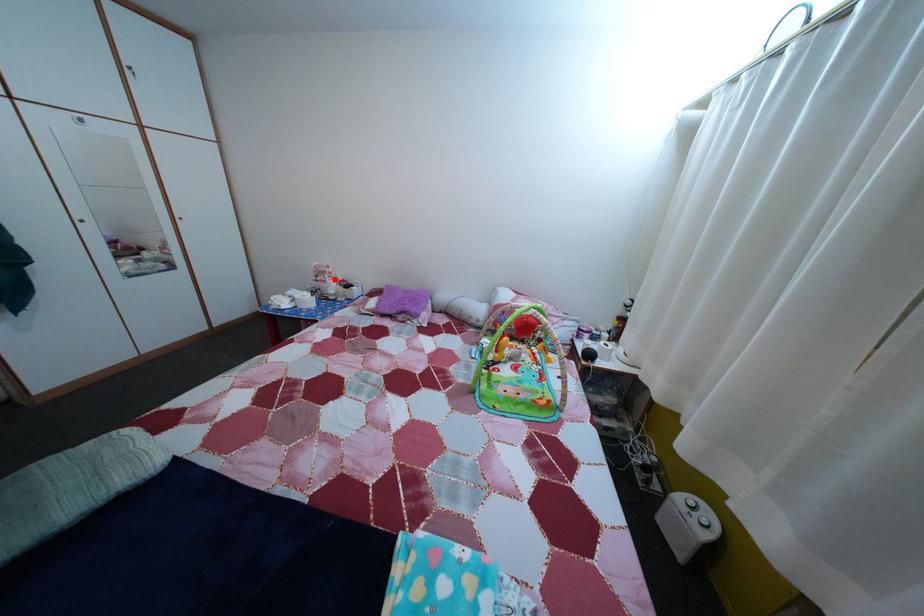
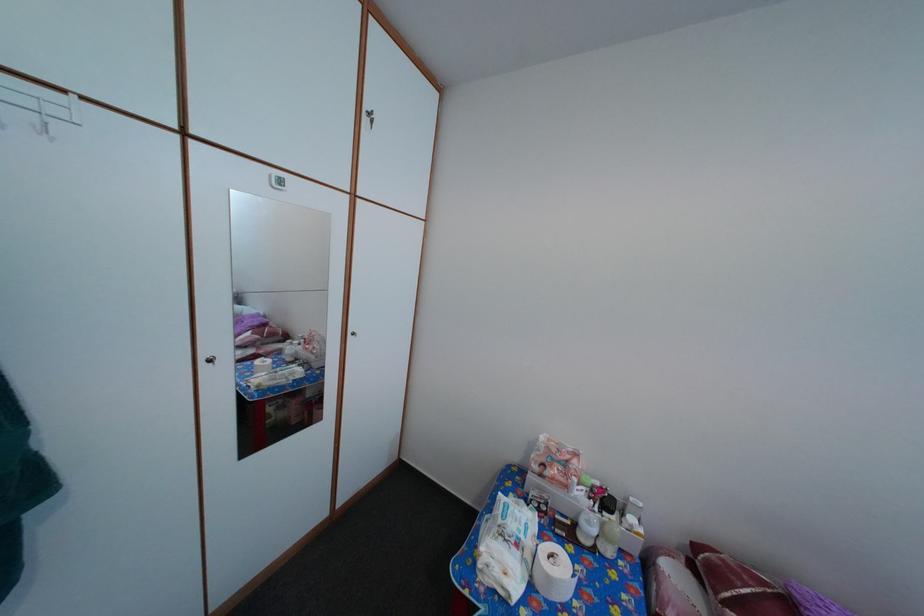
The point at the highlighted location is marked in the first image. Where is the corresponding point in the second image?

(576, 469)